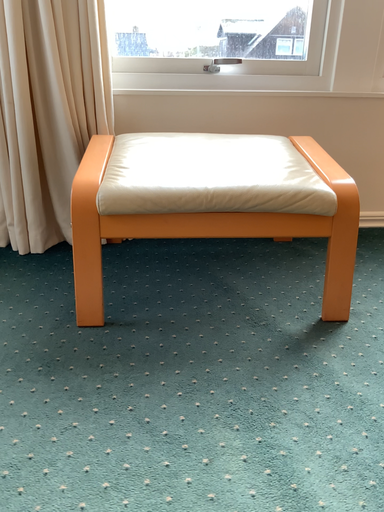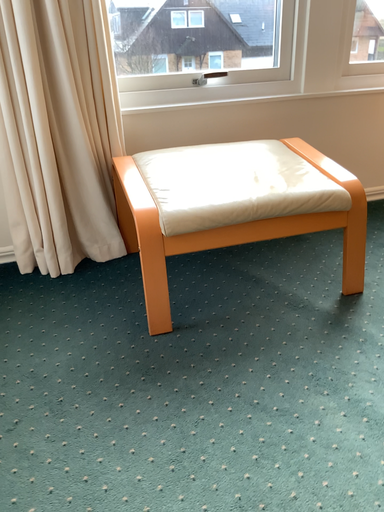
Question: How did the camera likely rotate when shooting the video?

Choices:
 (A) rotated left
 (B) rotated right

Answer: (B)